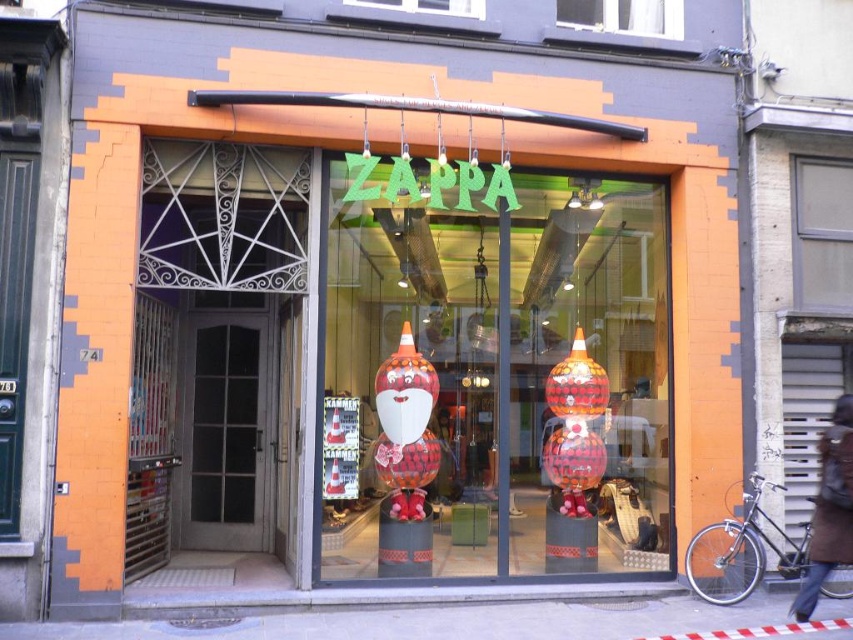
You are a customer looking at the Zappa shop. You see a brown leather coat at lower right and a transparent glass window at upper center. Which object is larger in size?

The brown leather coat at lower right is bigger than the transparent glass window at upper center.

You are a customer standing outside the Zappa shop entrance. You see the transparent glass window at upper right and the brown leather coat at lower right. Which object is positioned to the right side of the other?

The transparent glass window at upper right is to the right of brown leather coat at lower right.